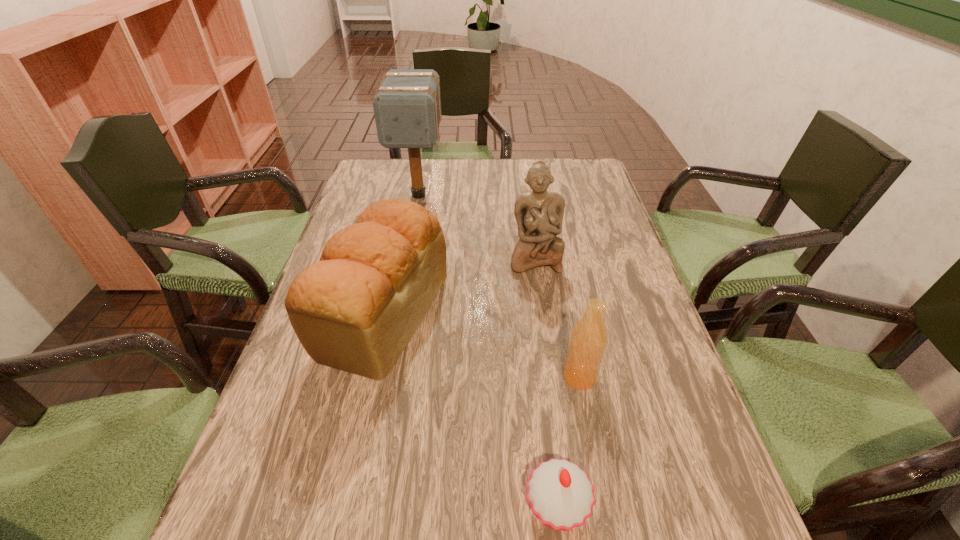
This screenshot has height=540, width=960. Identify the location of the farthest object. (407, 106).

Where is `mallet`? Image resolution: width=960 pixels, height=540 pixels. mallet is located at coordinates coord(407,106).

Where is `figurine`? Image resolution: width=960 pixels, height=540 pixels. figurine is located at coordinates (539, 214).

Where is `bread`? bread is located at coordinates (356, 309).

Find the location of a particular element. This screenshot has width=960, height=540. beer bottle is located at coordinates (589, 336).

In order to click on vacant area situated on the striking surface of the tallest object in this screenshot , I will do `click(410, 241)`.

The width and height of the screenshot is (960, 540). What are the coordinates of `free space located 0.120m on the front-facing side of the figurine` in the screenshot? It's located at (542, 309).

You are a GUI agent. You are given a task and a screenshot of the screen. Output one action in this format:
    pyautogui.click(x=<x>, y=<y>)
    Task: Click on the free space located on the back of the bread
    
    Given the screenshot: What is the action you would take?
    pyautogui.click(x=411, y=188)

The height and width of the screenshot is (540, 960). Find the location of `vacant area situated 0.060m on the left of the beer bottle`. vacant area situated 0.060m on the left of the beer bottle is located at coordinates (534, 377).

The height and width of the screenshot is (540, 960). In order to click on object located at the far edge in this screenshot , I will do `click(407, 106)`.